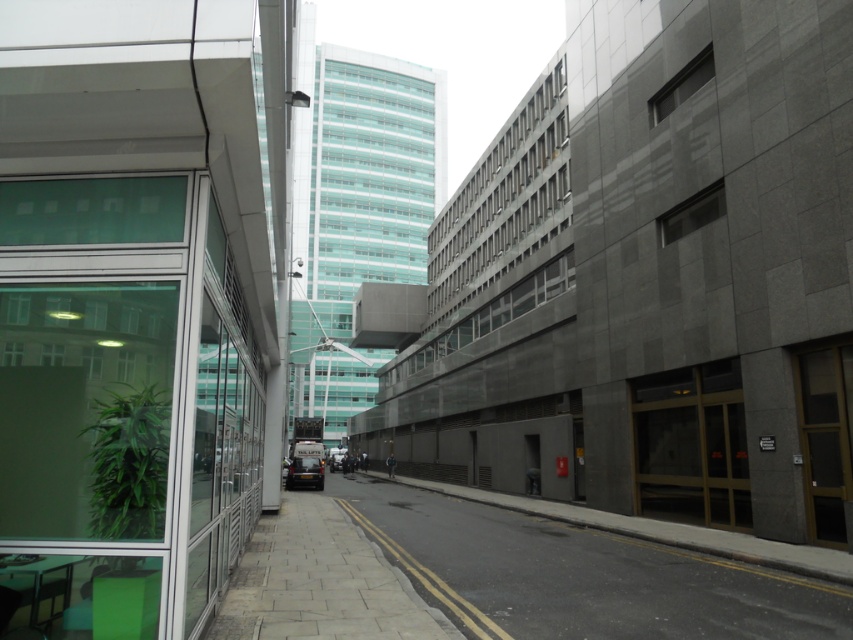
You are a delivery person trying to park your electric scooter. The scooter requires a space of at least 1.5 meters in length. You see the smooth concrete pavement at center and the paved stone sidewalk at lower left. Which location would allow you to park your scooter without it overhanging the edge?

The smooth concrete pavement at center has a larger size compared to the paved stone sidewalk at lower left, so the scooter can be parked on the smooth concrete pavement at center since it has enough space to accommodate the scooter without overhanging.

You are standing on the paved stone sidewalk at lower left marked by point (321, 582). Looking up, you see the tall, light blue green glass building in the center. Can you determine if the building is to your left or right side?

The tall, light blue green glass building in the center is directly in front of you, not to your left or right side.

You are standing at the center of the urban street scene. Where exactly is the smooth concrete pavement at center located?

The smooth concrete pavement at center is located at point (579, 577).